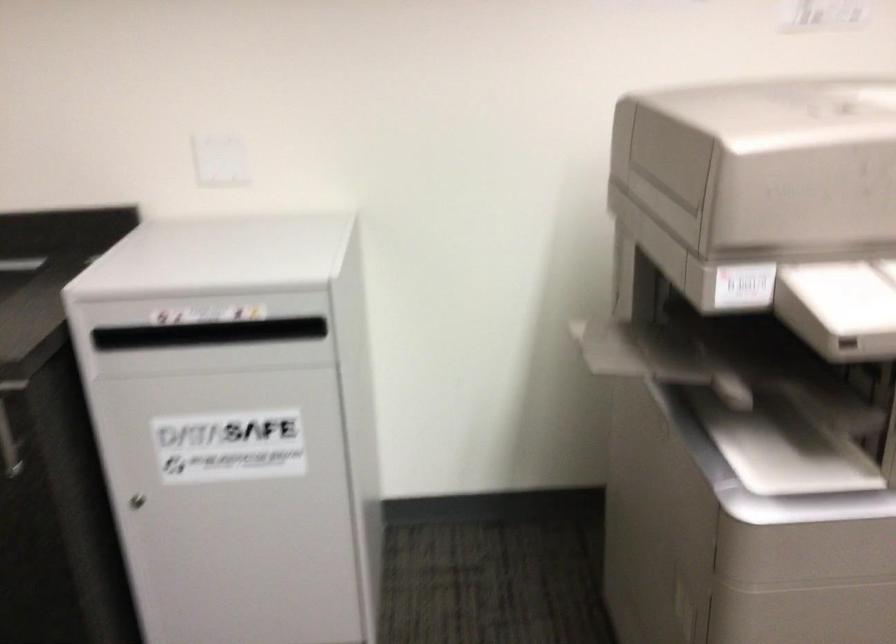
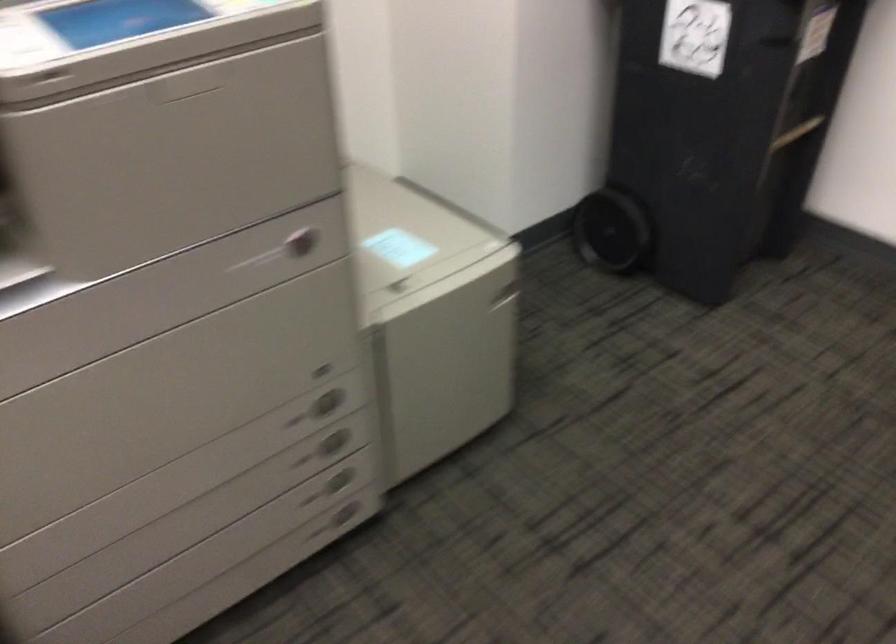
Based on the continuous images, in which direction is the camera rotating?

The rotation direction of the camera is right-down.